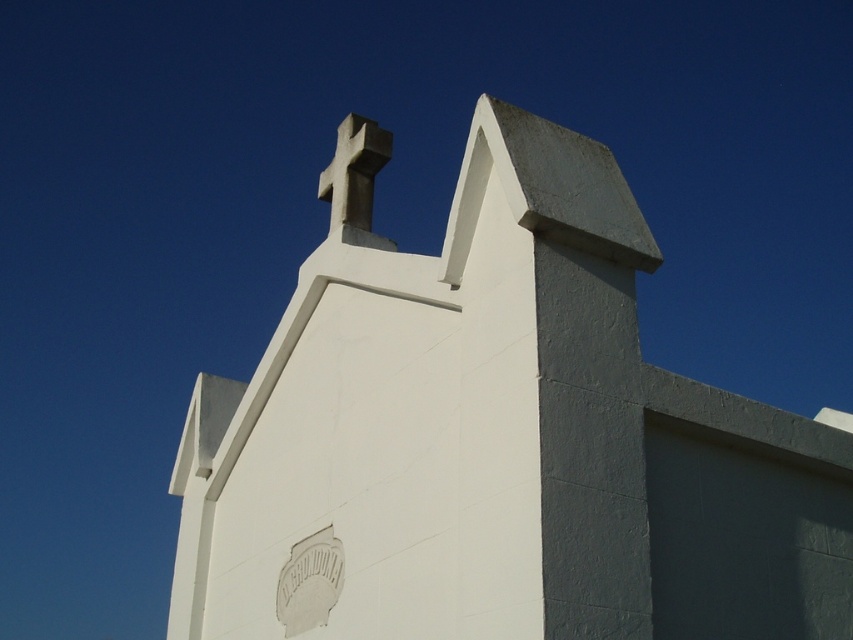
Question: Which of the following is the farthest from the observer?

Choices:
 (A) (279, 499)
 (B) (354, 140)

Answer: (B)

Question: Does white smooth stone church at center have a lesser width compared to white stone cross at upper center?

Choices:
 (A) no
 (B) yes

Answer: (A)

Question: Which point is farther to the camera?

Choices:
 (A) white smooth stone church at center
 (B) white stone cross at upper center

Answer: (B)

Question: Can you confirm if white smooth stone church at center is positioned to the right of white stone cross at upper center?

Choices:
 (A) yes
 (B) no

Answer: (A)

Question: Is white smooth stone church at center to the left of white stone cross at upper center from the viewer's perspective?

Choices:
 (A) no
 (B) yes

Answer: (A)